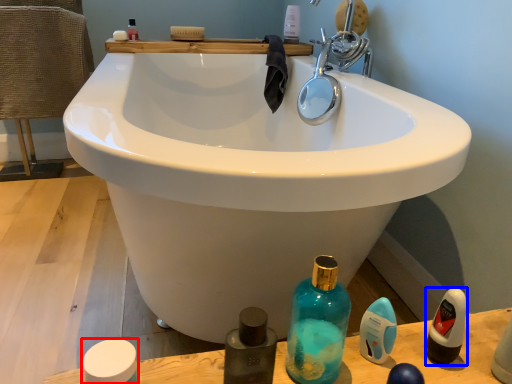
Question: Which object appears farthest to the camera in this image, mouthwash (highlighted by a red box) or mouthwash (highlighted by a blue box)?

Choices:
 (A) mouthwash
 (B) mouthwash

Answer: (B)